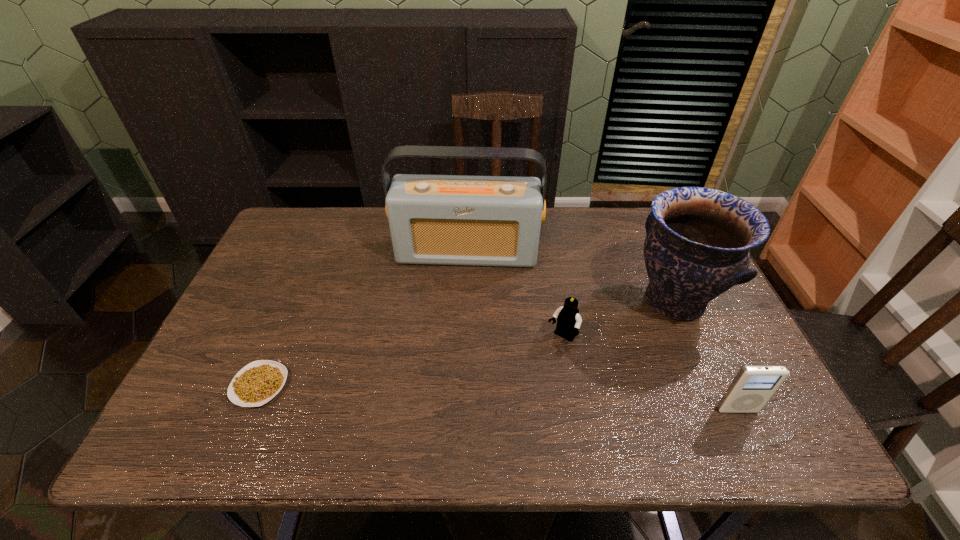
Identify the location of object that is the fourth closest to the pottery. (258, 382).

Where is `vacant space that satisfies the following two spatial constraints: 1. on the back side of the fourth shortest object; 2. on the left side of the legume`? vacant space that satisfies the following two spatial constraints: 1. on the back side of the fourth shortest object; 2. on the left side of the legume is located at coordinates 296,301.

Locate an element on the screen. The image size is (960, 540). free point that satisfies the following two spatial constraints: 1. on the front side of the second shortest object; 2. on the right side of the radio receiver is located at coordinates (465, 338).

You are a GUI agent. You are given a task and a screenshot of the screen. Output one action in this format:
    pyautogui.click(x=<x>, y=<y>)
    Task: Click on the free spot that satisfies the following two spatial constraints: 1. on the back side of the leftmost object; 2. on the right side of the tallest object
    
    Given the screenshot: What is the action you would take?
    pyautogui.click(x=316, y=253)

This screenshot has width=960, height=540. I want to click on vacant region that satisfies the following two spatial constraints: 1. on the back side of the fourth shortest object; 2. on the right side of the Lego, so click(x=556, y=301).